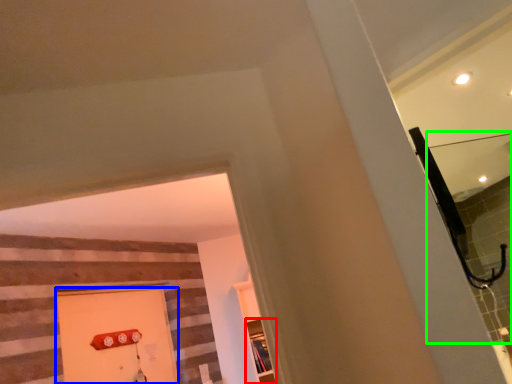
Question: Based on their relative distances, which object is nearer to shelf (highlighted by a red box)? Choose from door (highlighted by a blue box) and mirror (highlighted by a green box).

Choices:
 (A) door
 (B) mirror

Answer: (A)